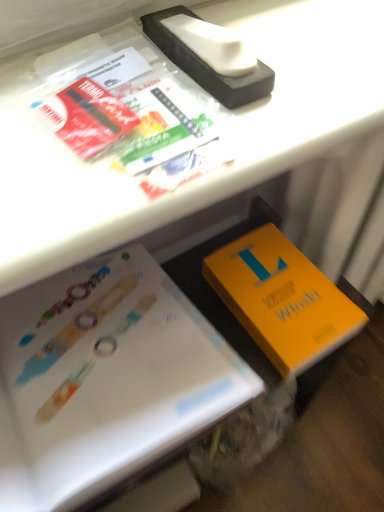
What is the approximate width of white paper at lower left, which appears as the 2th book when viewed from the right?

white paper at lower left, which appears as the 2th book when viewed from the right, is 9.30 inches in width.

The image size is (384, 512). What are the coordinates of `white paper at lower left, which appears as the 2th book when viewed from the right` in the screenshot? It's located at (109, 377).

What do you see at coordinates (109, 377) in the screenshot?
I see `white paper at lower left, arranged as the first book when viewed from the left` at bounding box center [109, 377].

Measure the distance between point [294,247] and camera.

Point [294,247] is 27.80 inches away from camera.

What do you see at coordinates (282, 298) in the screenshot? The image size is (384, 512). I see `orange matte book at lower right, which is the first book from right to left` at bounding box center [282, 298].

Find the location of a particular element. The image size is (384, 512). orange matte book at lower right, marked as the 2th book in a left-to-right arrangement is located at coordinates (282, 298).

In order to click on white paper at lower left, which appears as the 2th book when viewed from the right in this screenshot , I will do `click(109, 377)`.

Is orange matte book at lower right, which is the first book from right to left, at the right side of white paper at lower left, arranged as the first book when viewed from the left?

Indeed, orange matte book at lower right, which is the first book from right to left, is positioned on the right side of white paper at lower left, arranged as the first book when viewed from the left.

In the image, is orange matte book at lower right, marked as the 2th book in a left-to-right arrangement, positioned in front of or behind white paper at lower left, arranged as the first book when viewed from the left?

orange matte book at lower right, marked as the 2th book in a left-to-right arrangement, is behind white paper at lower left, arranged as the first book when viewed from the left.

Considering the positions of point (293, 353) and point (97, 442), is point (293, 353) closer or farther from the camera than point (97, 442)?

Clearly, point (293, 353) is more distant from the camera than point (97, 442).

Looking at this image, from the image's perspective, which one is positioned lower, orange matte book at lower right, which is the first book from right to left, or white paper at lower left, arranged as the first book when viewed from the left?

white paper at lower left, arranged as the first book when viewed from the left.

From a real-world perspective, between orange matte book at lower right, which is the first book from right to left, and white paper at lower left, which appears as the 2th book when viewed from the right, who is vertically lower?

orange matte book at lower right, which is the first book from right to left, is physically lower.

In terms of width, does orange matte book at lower right, which is the first book from right to left, look wider or thinner when compared to white paper at lower left, arranged as the first book when viewed from the left?

Clearly, orange matte book at lower right, which is the first book from right to left, has less width compared to white paper at lower left, arranged as the first book when viewed from the left.

Is orange matte book at lower right, marked as the 2th book in a left-to-right arrangement, shorter than white paper at lower left, arranged as the first book when viewed from the left?

Yes.

Between orange matte book at lower right, marked as the 2th book in a left-to-right arrangement, and white paper at lower left, arranged as the first book when viewed from the left, which one has larger size?

white paper at lower left, arranged as the first book when viewed from the left.

Could white paper at lower left, which appears as the 2th book when viewed from the right, be considered to be inside orange matte book at lower right, marked as the 2th book in a left-to-right arrangement?

Definitely not — white paper at lower left, which appears as the 2th book when viewed from the right, is not inside orange matte book at lower right, marked as the 2th book in a left-to-right arrangement.

Is orange matte book at lower right, marked as the 2th book in a left-to-right arrangement, not near white paper at lower left, arranged as the first book when viewed from the left?

That's not correct — orange matte book at lower right, marked as the 2th book in a left-to-right arrangement, is a little close to white paper at lower left, arranged as the first book when viewed from the left.

Is orange matte book at lower right, which is the first book from right to left, facing away from white paper at lower left, which appears as the 2th book when viewed from the right?

No, orange matte book at lower right, which is the first book from right to left, is not facing away from white paper at lower left, which appears as the 2th book when viewed from the right.

The image size is (384, 512). Find the location of `book that appears in front of the orange matte book at lower right, which is the first book from right to left`. book that appears in front of the orange matte book at lower right, which is the first book from right to left is located at coordinates (109, 377).

Which is more to the right, white paper at lower left, arranged as the first book when viewed from the left, or orange matte book at lower right, marked as the 2th book in a left-to-right arrangement?

orange matte book at lower right, marked as the 2th book in a left-to-right arrangement, is more to the right.

Considering the relative positions of white paper at lower left, which appears as the 2th book when viewed from the right, and orange matte book at lower right, which is the first book from right to left, in the image provided, is white paper at lower left, which appears as the 2th book when viewed from the right, behind orange matte book at lower right, which is the first book from right to left,?

No, white paper at lower left, which appears as the 2th book when viewed from the right, is closer to the camera.

Does point (68, 492) lie behind point (211, 265)?

No, it is in front of (211, 265).

From the image's perspective, which is above, white paper at lower left, which appears as the 2th book when viewed from the right, or orange matte book at lower right, which is the first book from right to left?

orange matte book at lower right, which is the first book from right to left, appears higher in the image.

From a real-world perspective, is white paper at lower left, which appears as the 2th book when viewed from the right, on orange matte book at lower right, which is the first book from right to left?

Yes, from a real-world perspective, white paper at lower left, which appears as the 2th book when viewed from the right, is over orange matte book at lower right, which is the first book from right to left

Considering the relative sizes of white paper at lower left, arranged as the first book when viewed from the left, and orange matte book at lower right, marked as the 2th book in a left-to-right arrangement, in the image provided, is white paper at lower left, arranged as the first book when viewed from the left, wider than orange matte book at lower right, marked as the 2th book in a left-to-right arrangement,?

Yes.

Considering the relative sizes of white paper at lower left, arranged as the first book when viewed from the left, and orange matte book at lower right, marked as the 2th book in a left-to-right arrangement, in the image provided, is white paper at lower left, arranged as the first book when viewed from the left, taller than orange matte book at lower right, marked as the 2th book in a left-to-right arrangement,?

Yes, white paper at lower left, arranged as the first book when viewed from the left, is taller than orange matte book at lower right, marked as the 2th book in a left-to-right arrangement.

Does white paper at lower left, which appears as the 2th book when viewed from the right, have a larger size compared to orange matte book at lower right, which is the first book from right to left?

Yes.

Does white paper at lower left, which appears as the 2th book when viewed from the right, contain orange matte book at lower right, which is the first book from right to left?

Actually, orange matte book at lower right, which is the first book from right to left, is outside white paper at lower left, which appears as the 2th book when viewed from the right.

Is white paper at lower left, which appears as the 2th book when viewed from the right, directly adjacent to orange matte book at lower right, which is the first book from right to left?

white paper at lower left, which appears as the 2th book when viewed from the right, and orange matte book at lower right, which is the first book from right to left, are not in contact.

Is white paper at lower left, which appears as the 2th book when viewed from the right, looking in the opposite direction of orange matte book at lower right, marked as the 2th book in a left-to-right arrangement?

No, orange matte book at lower right, marked as the 2th book in a left-to-right arrangement, is not at the back of white paper at lower left, which appears as the 2th book when viewed from the right.

There is a orange matte book at lower right, which is the first book from right to left. Where is `book above it (from a real-world perspective)`? Image resolution: width=384 pixels, height=512 pixels. book above it (from a real-world perspective) is located at coordinates (109, 377).

This screenshot has width=384, height=512. Identify the location of book that appears behind the white paper at lower left, arranged as the first book when viewed from the left. (282, 298).

Locate an element on the screen. book that appears on the left of orange matte book at lower right, which is the first book from right to left is located at coordinates (109, 377).